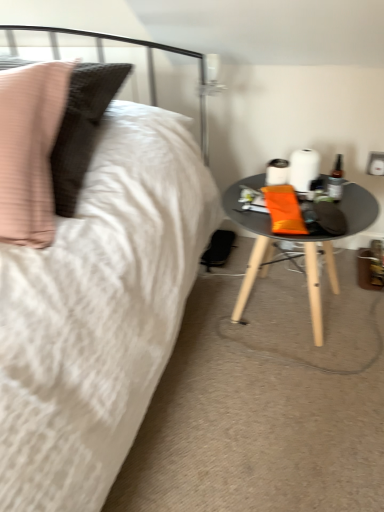
Image resolution: width=384 pixels, height=512 pixels. Find the location of `free point to the left of matte black table at lower right`. free point to the left of matte black table at lower right is located at coordinates (196, 332).